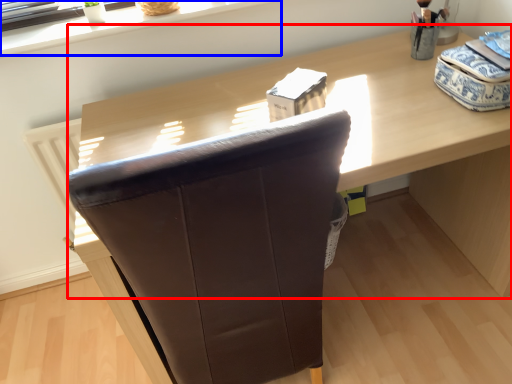
Question: Which point is closer to the camera, computer desk (highlighted by a red box) or window sill (highlighted by a blue box)?

Choices:
 (A) computer desk
 (B) window sill

Answer: (A)